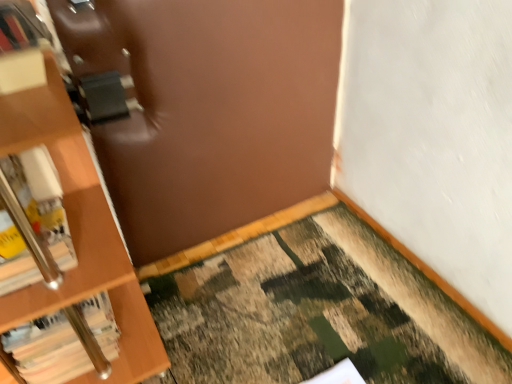
Question: From a real-world perspective, is hardcover book at left, which ranks as the 1th book in bottom-to-top order, positioned over white matte book at left, placed as the 1th book when sorted from top to bottom, based on gravity?

Choices:
 (A) no
 (B) yes

Answer: (A)

Question: Considering the relative sizes of hardcover book at left, marked as the 2th book in a top-to-bottom arrangement, and white matte book at left, placed as the 1th book when sorted from top to bottom, in the image provided, is hardcover book at left, marked as the 2th book in a top-to-bottom arrangement, taller than white matte book at left, placed as the 1th book when sorted from top to bottom,?

Choices:
 (A) yes
 (B) no

Answer: (A)

Question: Is hardcover book at left, marked as the 2th book in a top-to-bottom arrangement, looking in the opposite direction of white matte book at left, placed as the 2th book when sorted from bottom to top?

Choices:
 (A) yes
 (B) no

Answer: (B)

Question: Can you confirm if hardcover book at left, marked as the 2th book in a top-to-bottom arrangement, is positioned to the right of white matte book at left, placed as the 2th book when sorted from bottom to top?

Choices:
 (A) no
 (B) yes

Answer: (B)

Question: Is hardcover book at left, which ranks as the 1th book in bottom-to-top order, next to white matte book at left, placed as the 2th book when sorted from bottom to top, and touching it?

Choices:
 (A) yes
 (B) no

Answer: (B)

Question: Choose the correct answer: Is white matte book at left, placed as the 1th book when sorted from top to bottom, inside camouflage carpet at lower right or outside it?

Choices:
 (A) inside
 (B) outside

Answer: (B)

Question: Is white matte book at left, placed as the 1th book when sorted from top to bottom, bigger or smaller than camouflage carpet at lower right?

Choices:
 (A) small
 (B) big

Answer: (A)

Question: From a real-world perspective, relative to camouflage carpet at lower right, is white matte book at left, placed as the 1th book when sorted from top to bottom, vertically above or below?

Choices:
 (A) above
 (B) below

Answer: (A)

Question: Visually, is white matte book at left, placed as the 1th book when sorted from top to bottom, positioned to the left or to the right of camouflage carpet at lower right?

Choices:
 (A) right
 (B) left

Answer: (B)

Question: From a real-world perspective, relative to hardcover book at left, marked as the 2th book in a top-to-bottom arrangement, is white matte book at left, placed as the 1th book when sorted from top to bottom, vertically above or below?

Choices:
 (A) below
 (B) above

Answer: (B)

Question: Considering their positions, is white matte book at left, placed as the 2th book when sorted from bottom to top, located in front of or behind hardcover book at left, which ranks as the 1th book in bottom-to-top order?

Choices:
 (A) behind
 (B) front

Answer: (B)

Question: From the image's perspective, relative to hardcover book at left, marked as the 2th book in a top-to-bottom arrangement, is white matte book at left, placed as the 2th book when sorted from bottom to top, above or below?

Choices:
 (A) below
 (B) above

Answer: (B)

Question: Is white matte book at left, placed as the 2th book when sorted from bottom to top, wider or thinner than hardcover book at left, which ranks as the 1th book in bottom-to-top order?

Choices:
 (A) wide
 (B) thin

Answer: (A)

Question: Considering the positions of point (351, 321) and point (49, 336), is point (351, 321) closer or farther from the camera than point (49, 336)?

Choices:
 (A) closer
 (B) farther

Answer: (B)

Question: From a real-world perspective, is camouflage carpet at lower right positioned above or below hardcover book at left, marked as the 2th book in a top-to-bottom arrangement?

Choices:
 (A) below
 (B) above

Answer: (A)